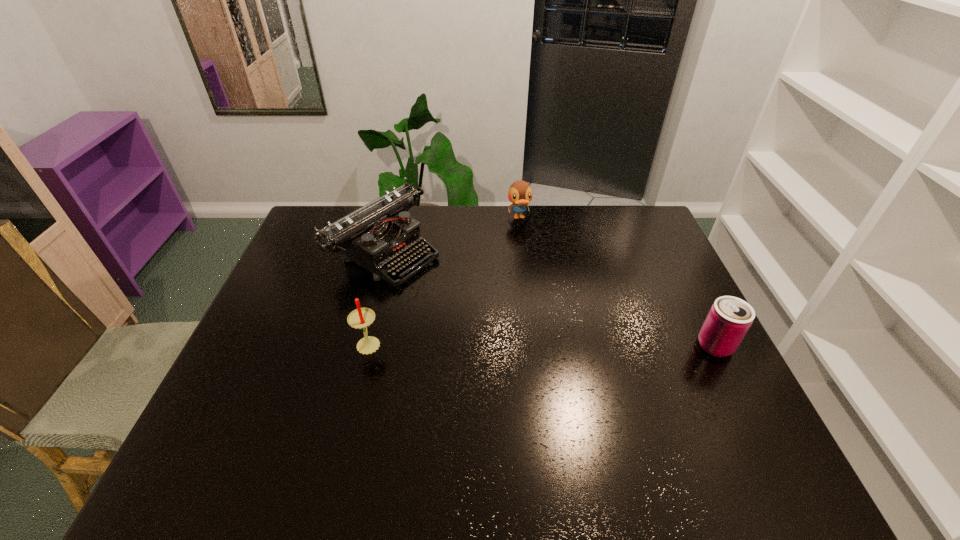
Find the location of `free spot between the typewriter and the candle`. free spot between the typewriter and the candle is located at coordinates (376, 297).

Point out which object is positioned as the nearest to the duck. Please provide its 2D coordinates. Your answer should be formatted as a tuple, i.e. [(x, y)], where the tuple contains the x and y coordinates of a point satisfying the conditions above.

[(379, 235)]

Identify the location of object that is the closest to the duck. (379, 235).